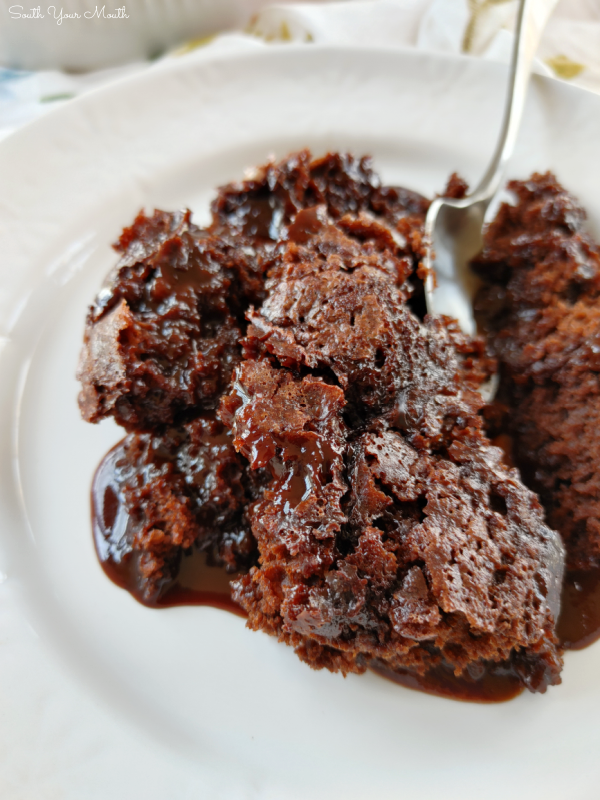
At what (x,y) coordinates should I click in order to perform the action: click on plate. Please return your answer as a coordinate pair (x, y). The height and width of the screenshot is (800, 600). Looking at the image, I should click on (30, 770).